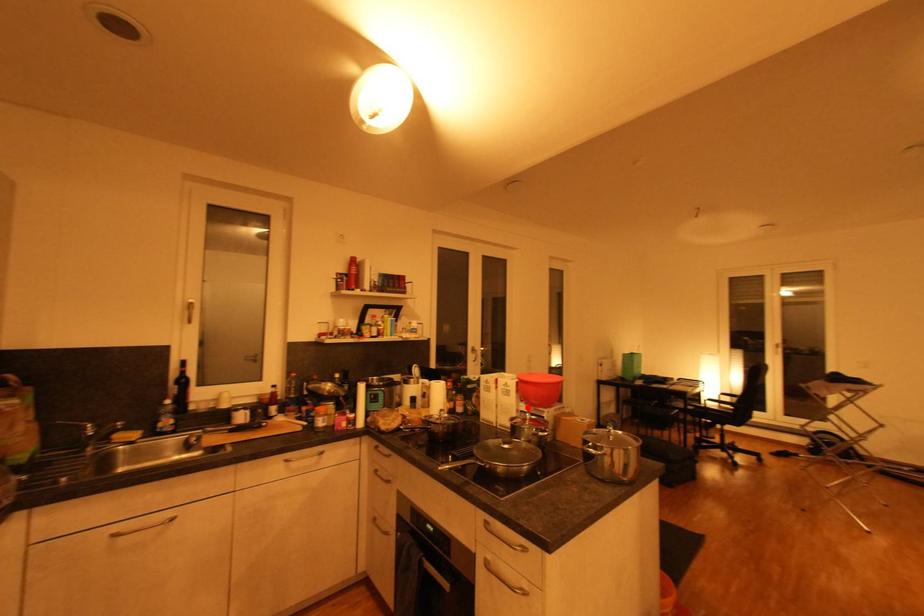
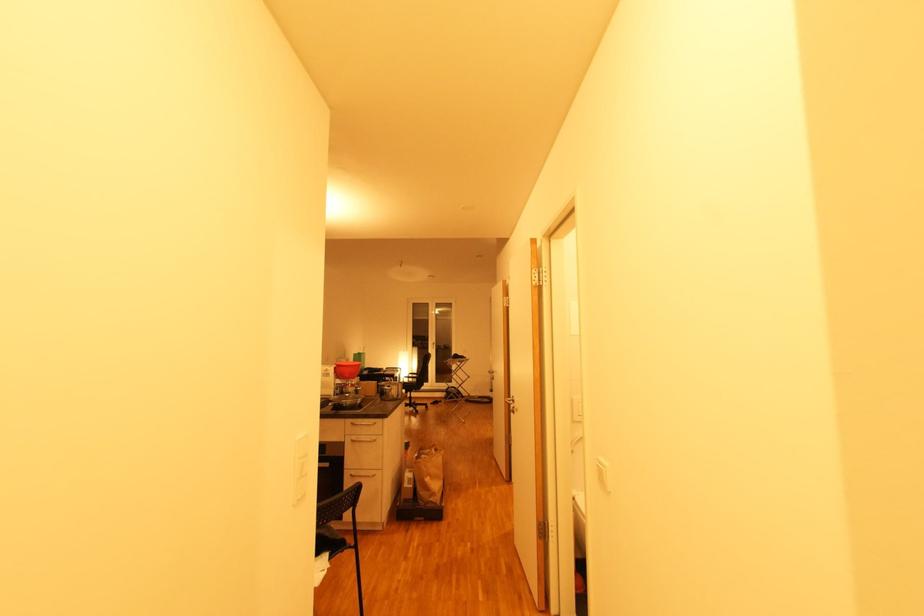
Locate, in the second image, the point that corresponds to the highlighted location in the first image.

(343, 382)